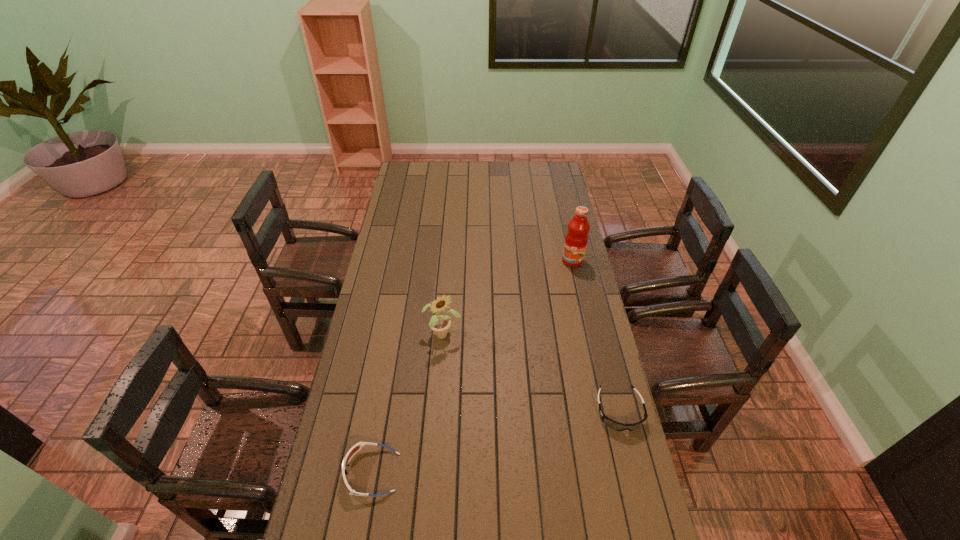
I want to click on vacant space positioned 0.320m on the front label of the tallest object, so (x=546, y=318).

Identify the location of vacant space located on the front label of the tallest object. This screenshot has height=540, width=960. (565, 276).

Find the location of a particular element. This screenshot has width=960, height=540. vacant space situated on the front-facing side of the second object from left to right is located at coordinates click(x=507, y=429).

You are a GUI agent. You are given a task and a screenshot of the screen. Output one action in this format:
    pyautogui.click(x=<x>, y=<y>)
    Task: Click on the free space located 0.350m on the front-facing side of the second object from left to right
    
    Given the screenshot: What is the action you would take?
    pyautogui.click(x=500, y=419)

The width and height of the screenshot is (960, 540). In order to click on free space located on the front-facing side of the second object from left to right in this screenshot , I will do `click(468, 368)`.

You are a GUI agent. You are given a task and a screenshot of the screen. Output one action in this format:
    pyautogui.click(x=<x>, y=<y>)
    Task: Click on the object located in the left edge section of the desktop
    The image size is (960, 540).
    Given the screenshot: What is the action you would take?
    pyautogui.click(x=356, y=447)

The height and width of the screenshot is (540, 960). In order to click on goggles situated at the right edge in this screenshot , I will do `click(617, 426)`.

The width and height of the screenshot is (960, 540). Find the location of `fruit juice located at the right edge`. fruit juice located at the right edge is located at coordinates (576, 239).

In the image, there is a desktop. Where is `vacant space at the far edge`? This screenshot has width=960, height=540. vacant space at the far edge is located at coordinates (532, 176).

The height and width of the screenshot is (540, 960). Identify the location of blank space at the left edge of the desktop. (417, 186).